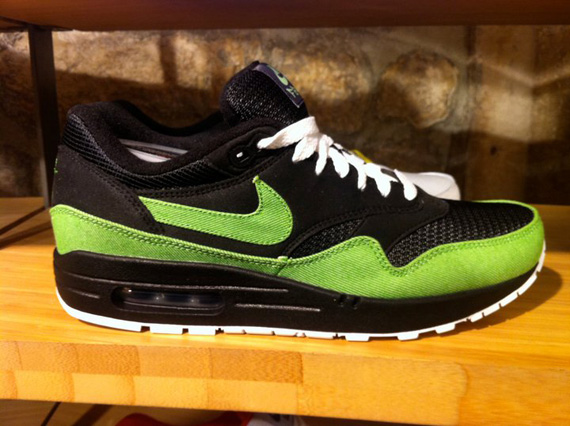
Identify the location of shoe. The height and width of the screenshot is (426, 570). (324, 199).